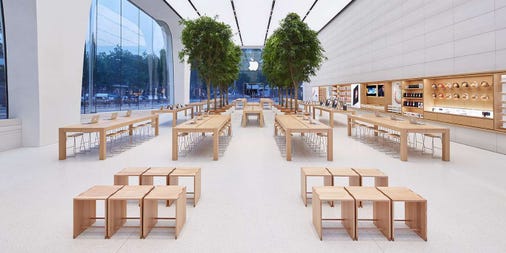
Where is `shelfs`? This screenshot has height=253, width=506. shelfs is located at coordinates (418, 97).